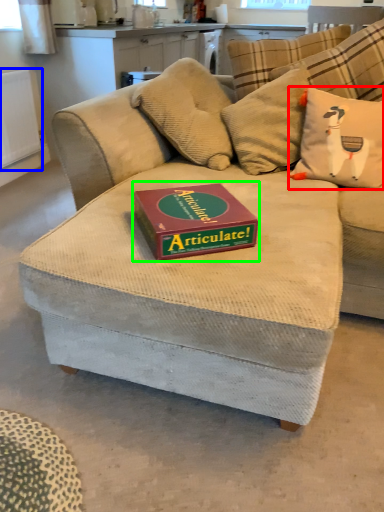
Question: Estimate the real-world distances between objects in this image. Which object is farther from throw pillow (highlighted by a red box), radiator (highlighted by a blue box) or paperback book (highlighted by a green box)?

Choices:
 (A) radiator
 (B) paperback book

Answer: (A)